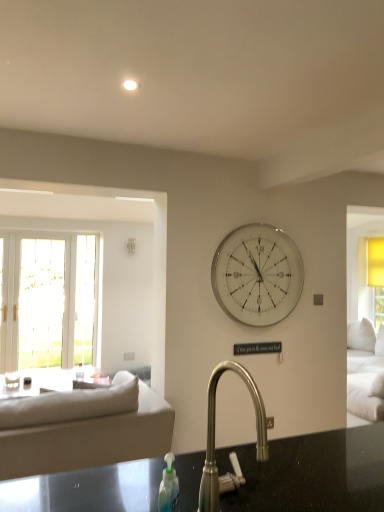
Find the location of a particular element. This screenshot has height=512, width=384. white glass wall clock at center is located at coordinates (257, 275).

Image resolution: width=384 pixels, height=512 pixels. What are the coordinates of `beige fabric couch at left` in the screenshot? It's located at (80, 424).

Which object is thinner, white glass wall clock at center or beige fabric couch at left?

Thinner between the two is white glass wall clock at center.

Which object is positioned more to the left, white glass wall clock at center or beige fabric couch at left?

From the viewer's perspective, beige fabric couch at left appears more on the left side.

Is white glass wall clock at center facing towards beige fabric couch at left?

No.

From the picture: Which object is closer to the camera, white glass wall clock at center or beige fabric couch at left?

beige fabric couch at left is in front.

How far apart are satin nickel faucet at center and beige fabric couch at left?

The distance of satin nickel faucet at center from beige fabric couch at left is 4.34 feet.

Identify the location of studio couch lying on the left of satin nickel faucet at center. (80, 424).

Would you consider satin nickel faucet at center to be distant from beige fabric couch at left?

satin nickel faucet at center is positioned a significant distance from beige fabric couch at left.

Consider the image. From the image's perspective, is satin nickel faucet at center located above beige fabric couch at left?

Yes, from the image's perspective, satin nickel faucet at center is above beige fabric couch at left.

From a real-world perspective, which object rests below the other?

beige fabric couch at left, from a real-world perspective.

Considering the positions of objects beige fabric couch at left and satin nickel faucet at center in the image provided, who is more to the left, beige fabric couch at left or satin nickel faucet at center?

beige fabric couch at left is more to the left.

In the image, there is a satin nickel faucet at center. At what (x,y) coordinates should I click in order to perform the action: click on studio couch below it (from the image's perspective). Please return your answer as a coordinate pair (x, y). The image size is (384, 512). Looking at the image, I should click on (80, 424).

Is white glass wall clock at center positioned with its back to satin nickel faucet at center?

white glass wall clock at center is not turned away from satin nickel faucet at center.

Between white glass wall clock at center and satin nickel faucet at center, which one appears on the left side from the viewer's perspective?

satin nickel faucet at center is more to the left.

Considering the relative sizes of white glass wall clock at center and satin nickel faucet at center in the image provided, is white glass wall clock at center shorter than satin nickel faucet at center?

In fact, white glass wall clock at center may be taller than satin nickel faucet at center.

Based on the photo, is satin nickel faucet at center completely or partially inside white glass wall clock at center?

No, satin nickel faucet at center is not a part of white glass wall clock at center.

Locate an element on the screen. This screenshot has height=512, width=384. tap on the left of white glass wall clock at center is located at coordinates (214, 440).

Does point (210, 493) come farther from viewer compared to point (238, 298)?

No.

Is satin nickel faucet at center at the right side of white glass wall clock at center?

No.

Is point (51, 445) positioned behind point (266, 313)?

No.

From a real-world perspective, is beige fabric couch at left on top of white glass wall clock at center?

A: No, from a real-world perspective, beige fabric couch at left is not over white glass wall clock at center

Who is smaller, beige fabric couch at left or white glass wall clock at center?

Smaller between the two is white glass wall clock at center.

Which is behind, beige fabric couch at left or white glass wall clock at center?

white glass wall clock at center.

The height and width of the screenshot is (512, 384). I want to click on studio couch directly beneath the white glass wall clock at center (from a real-world perspective), so click(x=80, y=424).

Where is `studio couch behind the satin nickel faucet at center`? The height and width of the screenshot is (512, 384). studio couch behind the satin nickel faucet at center is located at coordinates (80, 424).

When comparing their distances from satin nickel faucet at center, does white glass wall clock at center or beige fabric couch at left seem closer?

The object closer to satin nickel faucet at center is beige fabric couch at left.

From the image, which object appears to be nearer to beige fabric couch at left, white glass wall clock at center or satin nickel faucet at center?

white glass wall clock at center is positioned closer to the anchor beige fabric couch at left.

Considering their positions, is beige fabric couch at left positioned closer to white glass wall clock at center than satin nickel faucet at center?

beige fabric couch at left.

Estimate the real-world distances between objects in this image. Which object is further from beige fabric couch at left, satin nickel faucet at center or white glass wall clock at center?

satin nickel faucet at center.

Based on their spatial positions, is beige fabric couch at left or white glass wall clock at center closer to satin nickel faucet at center?

beige fabric couch at left is positioned closer to the anchor satin nickel faucet at center.

Consider the image. Looking at the image, which one is located closer to white glass wall clock at center, satin nickel faucet at center or beige fabric couch at left?

beige fabric couch at left lies closer to white glass wall clock at center than the other object.

I want to click on studio couch between satin nickel faucet at center and white glass wall clock at center along the z-axis, so [x=80, y=424].